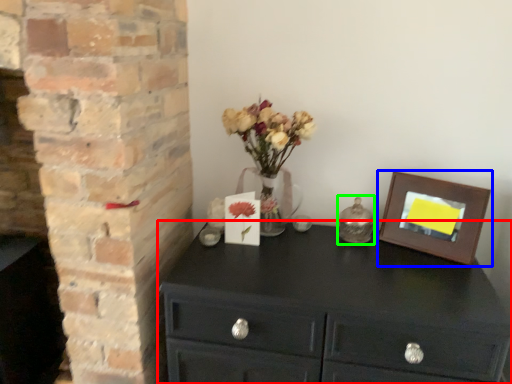
Question: Based on their relative distances, which object is nearer to chest of drawers (highlighted by a red box)? Choose from picture frame (highlighted by a blue box) and candle holder (highlighted by a green box).

Choices:
 (A) picture frame
 (B) candle holder

Answer: (A)